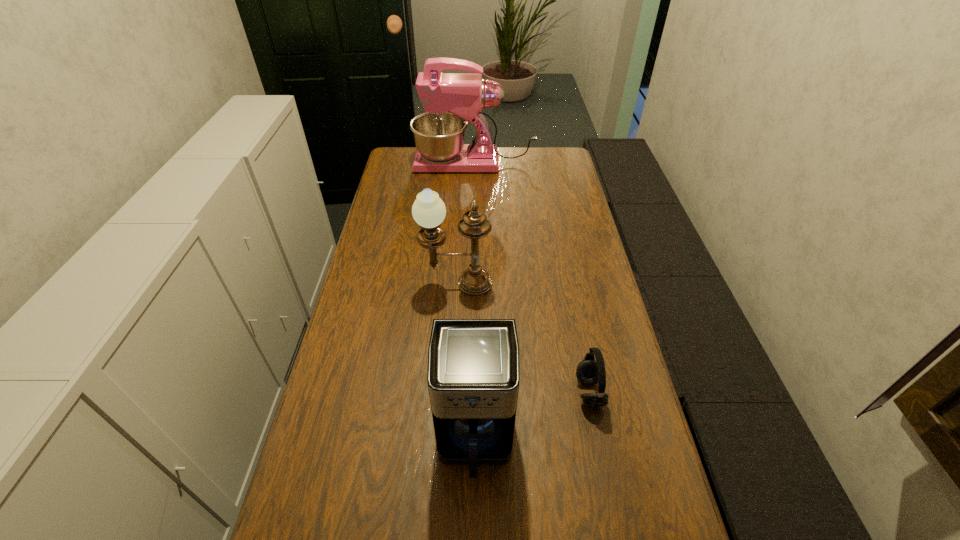
At what (x,y) coordinates should I click in order to perform the action: click on vacant space at the far right corner of the desktop. Please return your answer as a coordinate pair (x, y). The height and width of the screenshot is (540, 960). Looking at the image, I should click on (532, 147).

Where is `free space between the mixer and the coffee maker`? The image size is (960, 540). free space between the mixer and the coffee maker is located at coordinates (474, 301).

Locate an element on the screen. free area in between the tallest object and the coffee maker is located at coordinates (474, 301).

Identify the location of vacant space that is in between the shortest object and the oil lamp. Image resolution: width=960 pixels, height=540 pixels. (523, 338).

Find the location of `object that is the second closest to the rightmost object`. object that is the second closest to the rightmost object is located at coordinates (428, 210).

Select which object appears as the closest to the coffee maker. Please provide its 2D coordinates. Your answer should be formatted as a tuple, i.e. [(x, y)], where the tuple contains the x and y coordinates of a point satisfying the conditions above.

[(589, 371)]

Where is `vacant point that satisfies the following two spatial constraints: 1. on the ear cups of the headset; 2. on the front panel of the coffee maker`? vacant point that satisfies the following two spatial constraints: 1. on the ear cups of the headset; 2. on the front panel of the coffee maker is located at coordinates (599, 438).